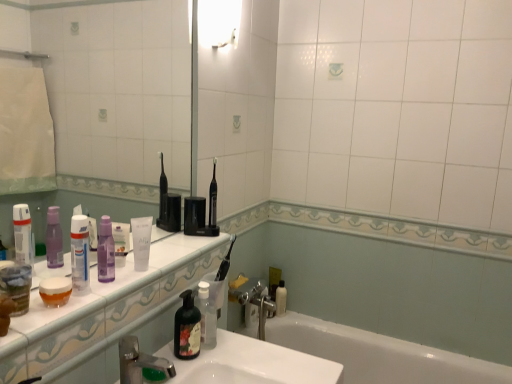
At what (x,y) coordinates should I click in order to perform the action: click on space that is in front of white matte tube at center, placed as the 2th toiletry when sorted from left to right. Please return your answer as a coordinate pair (x, y). The height and width of the screenshot is (384, 512). Looking at the image, I should click on (106, 289).